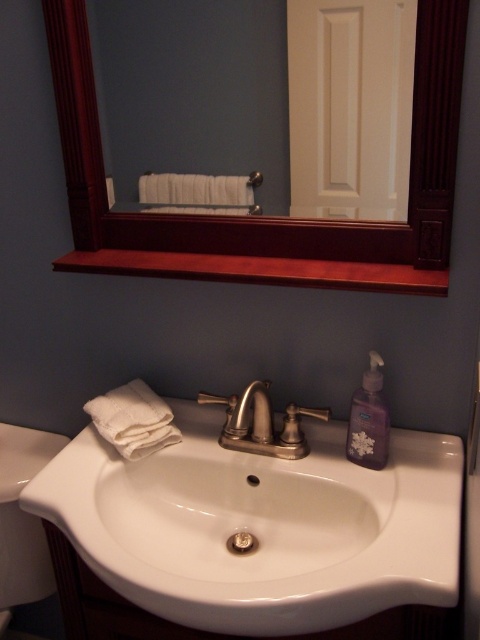
You are standing in front of the bathroom sink and want to reach the mahogany wood mirror at upper center. Which direction should you move your hand to touch it?

The mahogany wood mirror at upper center is located at point (x=267, y=218), so you should move your hand upward and slightly to the left to touch it.

You are a bathroom designer checking the layout. You notice the white glossy sink at center and the translucent plastic soap at sink center. Which object takes up more space in the bathroom?

The white glossy sink at center is larger in size than the translucent plastic soap at sink center, so it takes up more space in the bathroom.

You are standing in front of the bathroom sink area and need to locate the white glossy sink at center. According to the coordinates provided, where exactly is it positioned?

The white glossy sink at center is positioned at coordinates point [264,528].